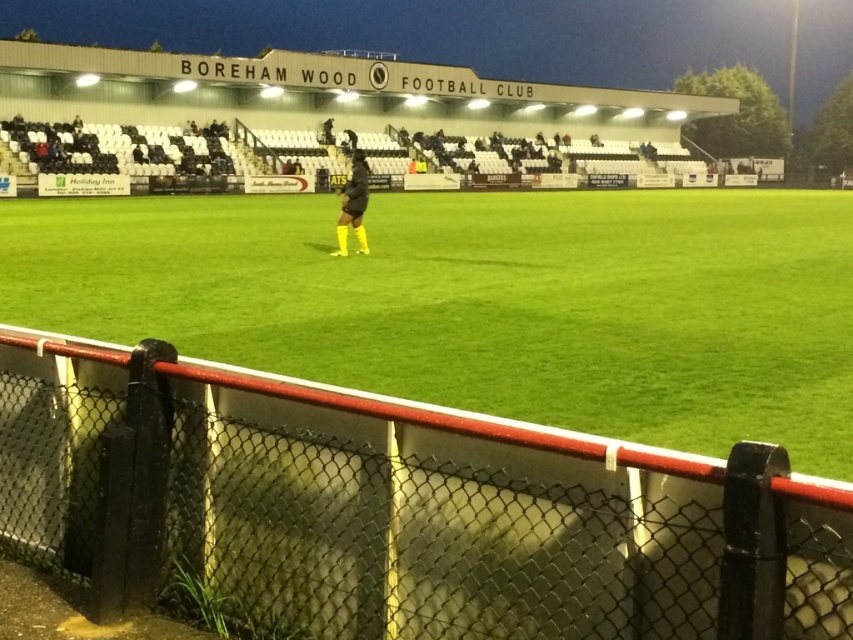
Question: Which object appears closest to the camera in this image?

Choices:
 (A) matte black jacket at center
 (B) black chain-link fence at center

Answer: (B)

Question: Can you confirm if black chain-link fence at center is positioned to the right of matte black jacket at center?

Choices:
 (A) yes
 (B) no

Answer: (A)

Question: Can you confirm if black chain-link fence at center is positioned below matte black jacket at center?

Choices:
 (A) no
 (B) yes

Answer: (B)

Question: Which point is farther from the camera taking this photo?

Choices:
 (A) (287, 477)
 (B) (354, 170)

Answer: (B)

Question: Can you confirm if black chain-link fence at center is positioned above matte black jacket at center?

Choices:
 (A) yes
 (B) no

Answer: (B)